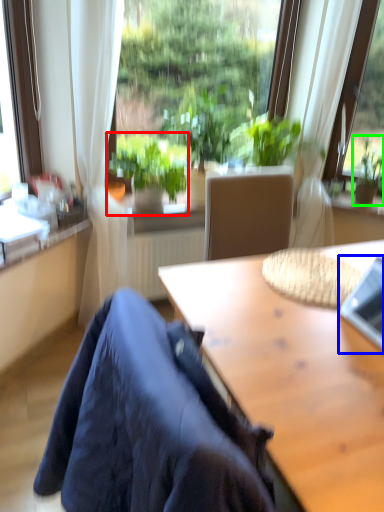
Question: Estimate the real-world distances between objects in this image. Which object is closer to houseplant (highlighted by a red box), laptop (highlighted by a blue box) or houseplant (highlighted by a green box)?

Choices:
 (A) laptop
 (B) houseplant

Answer: (A)